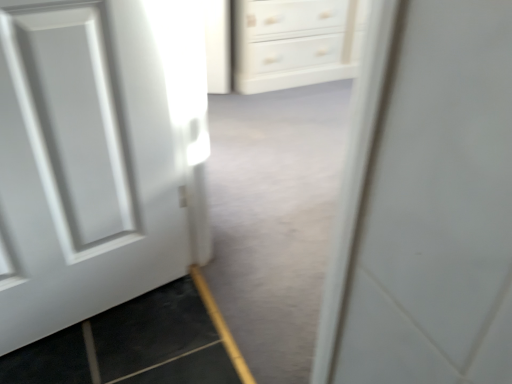
Describe the element at coordinates (295, 42) in the screenshot. This screenshot has width=512, height=384. I see `white glossy chest of drawers at upper center` at that location.

I want to click on white glossy chest of drawers at upper center, so click(295, 42).

Locate an element on the screen. The image size is (512, 384). white glossy chest of drawers at upper center is located at coordinates (295, 42).